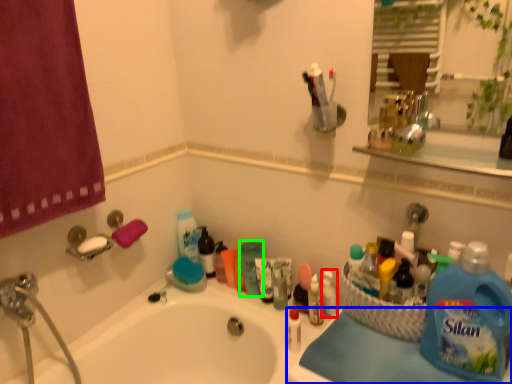
Question: Based on their relative distances, which object is nearer to toiletry (highlighted by a red box)? Choose from counter top (highlighted by a blue box) and cleaning product (highlighted by a green box).

Choices:
 (A) counter top
 (B) cleaning product

Answer: (B)